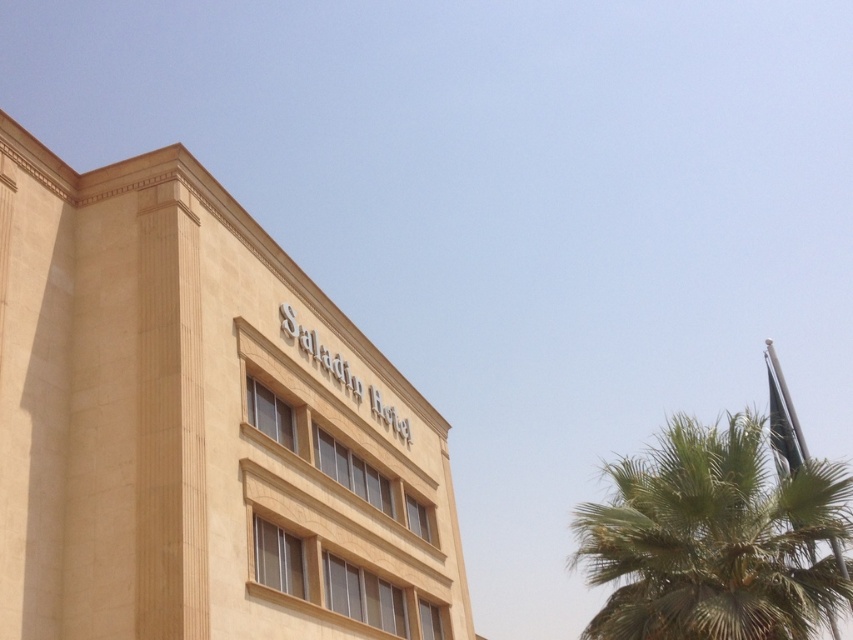
You are standing in front of the Saladin Hotel and want to take a photo of the beige stone saladin hotel at upper center and the green leafy palm tree at right. Which object will appear larger in the photo?

The beige stone saladin hotel at upper center is positioned over the green leafy palm tree at right, so it will appear larger in the photo.

You are standing in front of the Saladin Hotel and need to locate the beige stone Saladin Hotel at upper center. According to the coordinates provided, where exactly is it positioned?

The beige stone Saladin Hotel at upper center is located at point coordinates of 0.667 on the x axis and 0.236 on the y axis.

You are standing in front of the Saladin Hotel and want to take a photo that includes both the beige stone saladin hotel at upper center and the green leafy palm tree at right. Based on their sizes, which object should you position closer to the center of your camera frame to ensure both fit in the photo?

Since the beige stone saladin hotel at upper center is smaller than the green leafy palm tree at right, you should position the beige stone saladin hotel at upper center closer to the center of your camera frame to ensure both fit in the photo.